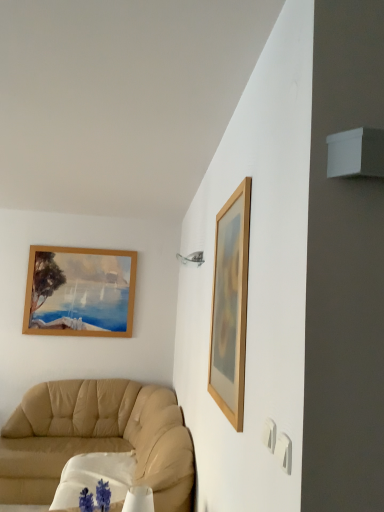
Question: From the image's perspective, relative to beige leather couch at lower left, is white fabric round table at lower left above or below?

Choices:
 (A) below
 (B) above

Answer: (A)

Question: Is white fabric round table at lower left taller or shorter than beige leather couch at lower left?

Choices:
 (A) tall
 (B) short

Answer: (B)

Question: Estimate the real-world distances between objects in this image. Which object is closer to the wooden picture frame at upper right?

Choices:
 (A) beige leather couch at lower left
 (B) white fabric round table at lower left

Answer: (B)

Question: Which is farther from the beige leather couch at lower left?

Choices:
 (A) white fabric round table at lower left
 (B) wooden picture frame at upper right

Answer: (B)